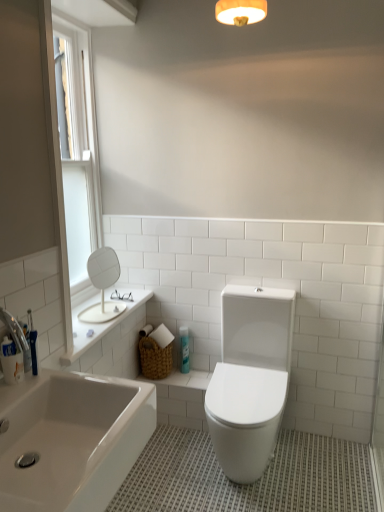
Question: From a real-world perspective, is white plastic window screen at upper left physically located above or below blue glossy spray can at center?

Choices:
 (A) below
 (B) above

Answer: (B)

Question: In terms of width, does white plastic window screen at upper left look wider or thinner when compared to blue glossy spray can at center?

Choices:
 (A) thin
 (B) wide

Answer: (A)

Question: Based on their relative distances, which object is nearer to the white glossy toilet at center?

Choices:
 (A) white glossy bathtub at lower left
 (B) blue glossy spray can at center
 (C) white plastic window screen at upper left
 (D) white matte round mirror at upper left

Answer: (B)

Question: Which of these objects is positioned farthest from the white glossy toilet at center?

Choices:
 (A) white matte round mirror at upper left
 (B) white plastic window screen at upper left
 (C) blue glossy spray can at center
 (D) white glossy bathtub at lower left

Answer: (B)